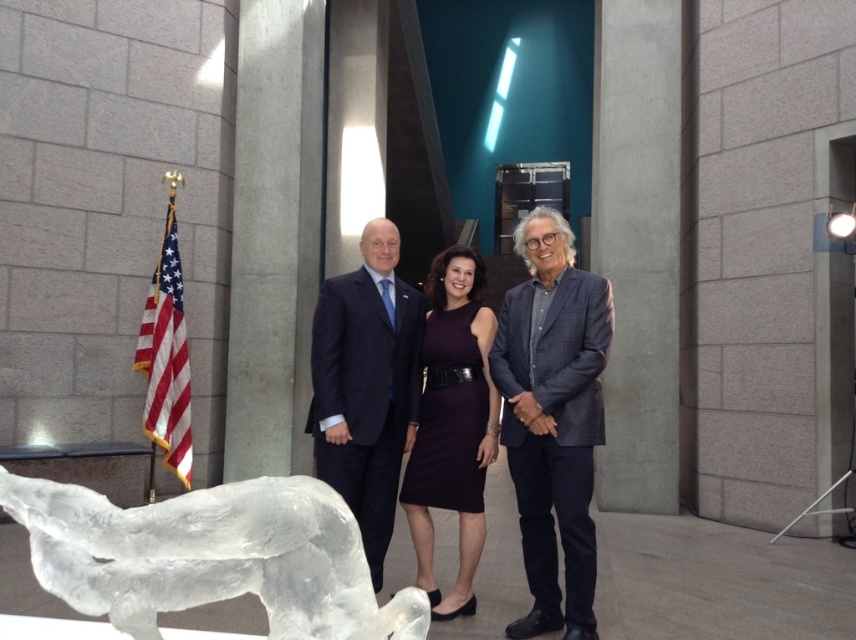
You are standing in the room where the three people are posing. You want to take a photo of the clear ice sculpture at lower left without the people blocking the view. Where should you position yourself relative to the people to ensure the sculpture is visible?

To take a photo of the clear ice sculpture at lower left without the people blocking the view, position yourself to the left side of the group since the sculpture is located at the lower left corner of the frame, away from the central group.

You are a photographer setting up for a formal event. You notice the clear ice sculpture at lower left and the blue plaid blazer at center. Which object is closer to the camera?

The clear ice sculpture at lower left is closer to the camera because it is in front of the blue plaid blazer at center.